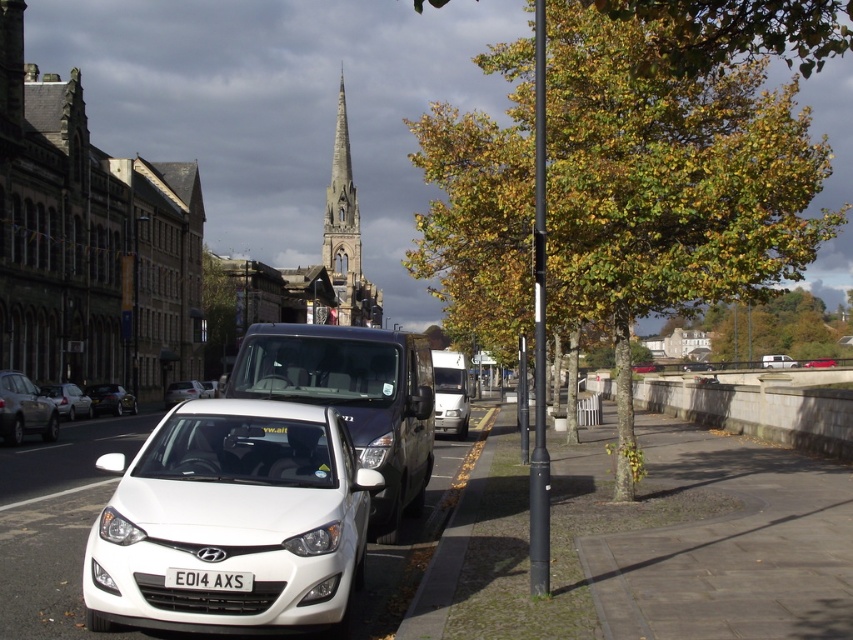
Can you confirm if white plastic license plate at center is positioned above white matte van at center?

Yes.

The width and height of the screenshot is (853, 640). I want to click on white plastic license plate at center, so click(207, 579).

Is white glossy hatchback at lower left bigger than glossy metallic van at center?

Correct, white glossy hatchback at lower left is larger in size than glossy metallic van at center.

Can you confirm if white glossy hatchback at lower left is positioned to the right of glossy metallic van at center?

Yes, white glossy hatchback at lower left is to the right of glossy metallic van at center.

Who is more distant from viewer, (196, 476) or (312, 396)?

Positioned behind is point (312, 396).

You are a GUI agent. You are given a task and a screenshot of the screen. Output one action in this format:
    pyautogui.click(x=<x>, y=<y>)
    Task: Click on the white glossy hatchback at lower left
    
    Given the screenshot: What is the action you would take?
    pyautogui.click(x=231, y=522)

Is dark stone church at center positioned at the back of matte silver car at left?

That is True.

Does dark stone church at center lie in front of matte silver car at left?

No, dark stone church at center is further to the viewer.

You are a GUI agent. You are given a task and a screenshot of the screen. Output one action in this format:
    pyautogui.click(x=<x>, y=<y>)
    Task: Click on the dark stone church at center
    Image resolution: width=853 pixels, height=640 pixels.
    Given the screenshot: What is the action you would take?
    pyautogui.click(x=90, y=241)

Where is `dark stone church at center`? Image resolution: width=853 pixels, height=640 pixels. dark stone church at center is located at coordinates (90, 241).